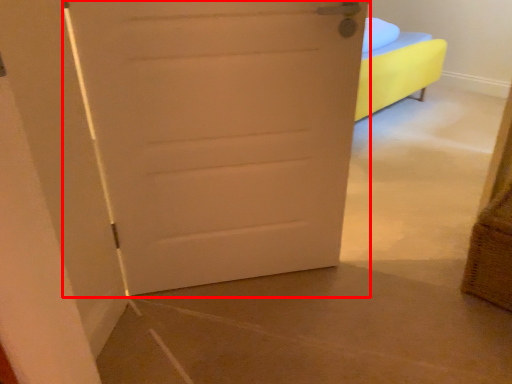
Question: Considering the relative positions of door (annotated by the red box) and basket in the image provided, where is door (annotated by the red box) located with respect to the staircase?

Choices:
 (A) left
 (B) right

Answer: (A)